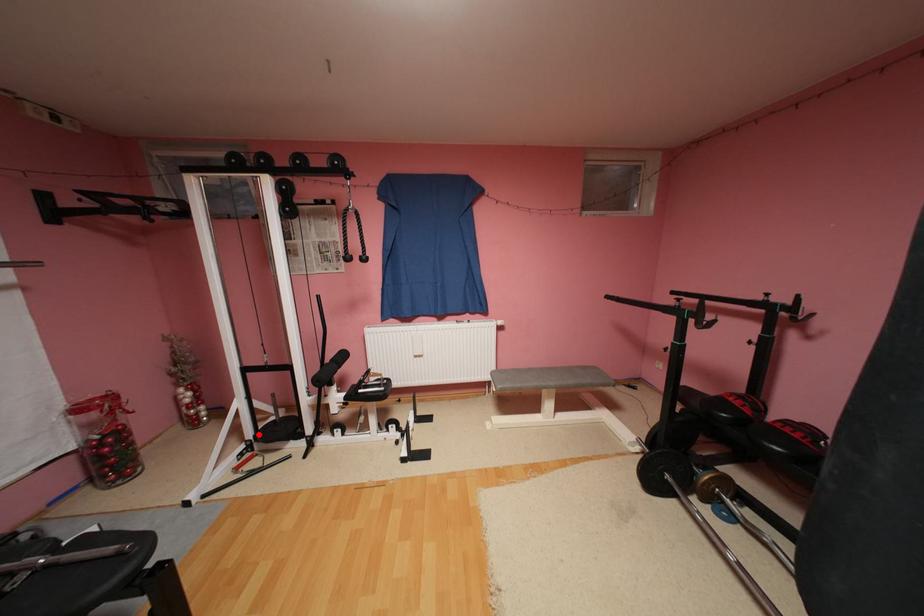
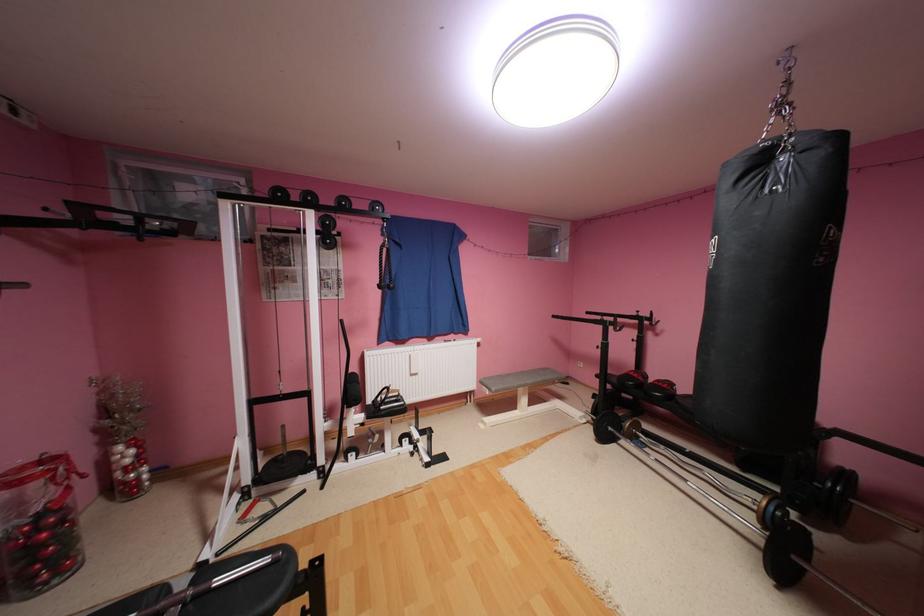
Question: I am providing you with two images of the same scene from different viewpoints. Image1 has a red point marked. In image2, the corresponding 3D location appears at what relative position? Reply with the corresponding letter.

Choices:
 (A) Closer
 (B) Farther

Answer: (A)